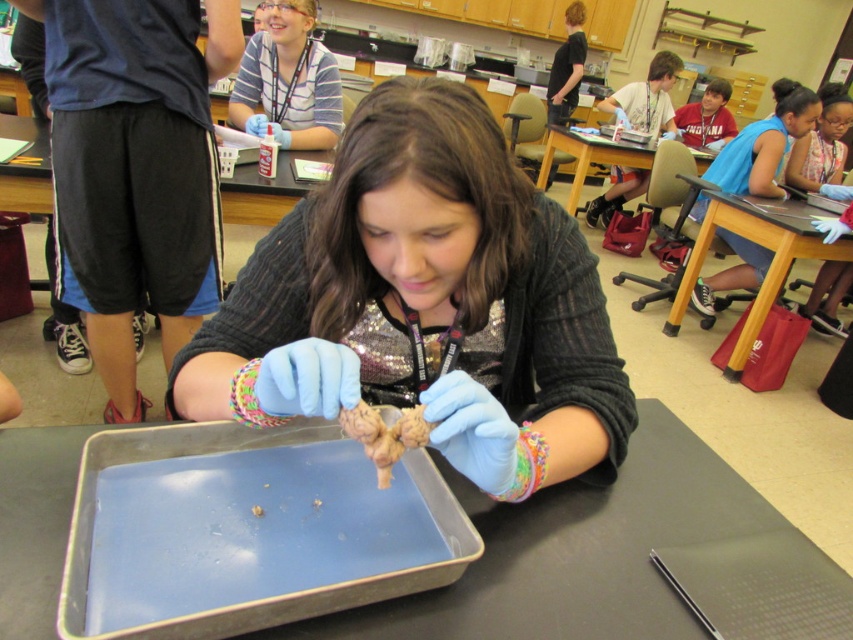
Question: Which object is positioned farthest from the sparkly sequin shirt at center?

Choices:
 (A) wooden table at center
 (B) metallic gray tray at center

Answer: (A)

Question: Is metallic gray tray at center bigger than wooden table at center?

Choices:
 (A) yes
 (B) no

Answer: (B)

Question: Based on their relative distances, which object is farther from the wooden table at center?

Choices:
 (A) matte plastic table at center
 (B) sparkly sequin shirt at center

Answer: (B)

Question: Does sparkly sequin shirt at center appear on the right side of matte plastic table at center?

Choices:
 (A) yes
 (B) no

Answer: (B)

Question: Which point is closer to the camera?

Choices:
 (A) (456, 244)
 (B) (236, 525)
 (C) (576, 186)

Answer: (B)

Question: Is metallic gray tray at center to the left of wooden table at center from the viewer's perspective?

Choices:
 (A) yes
 (B) no

Answer: (A)